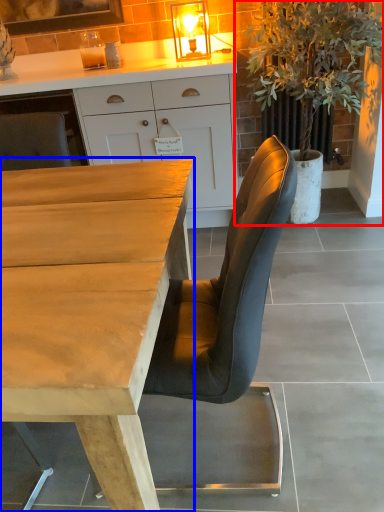
Question: Which point is further to the camera, houseplant (highlighted by a red box) or desk (highlighted by a blue box)?

Choices:
 (A) houseplant
 (B) desk

Answer: (A)